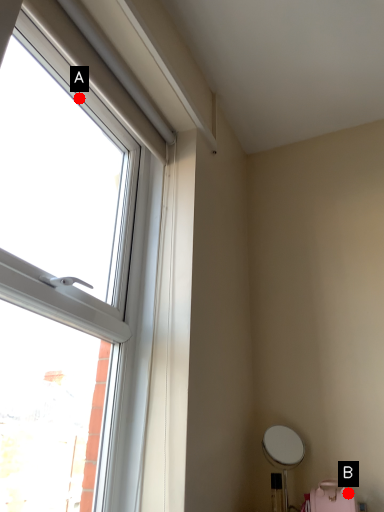
Question: Two points are circled on the image, labeled by A and B beside each circle. Which point is further to the camera?

Choices:
 (A) A is further
 (B) B is further

Answer: (A)